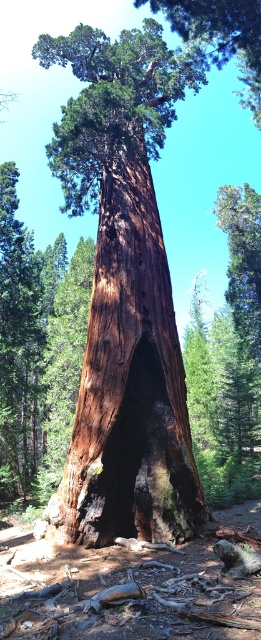
You are a park ranger inspecting the giant sequoia tree. You notice the brown rough bark at center and the smooth brown bark at upper center. Which part of the tree is located higher up?

The smooth brown bark at upper center is located higher up than the brown rough bark at center.

You are a biologist studying tree bark thickness. You observe the brown rough bark at center and the smooth brown bark at upper center. Which part of the tree would you recommend measuring for a thicker bark sample?

The smooth brown bark at upper center has a thicker bark than the brown rough bark at center, so you should measure the smooth brown bark at upper center for a thicker sample.